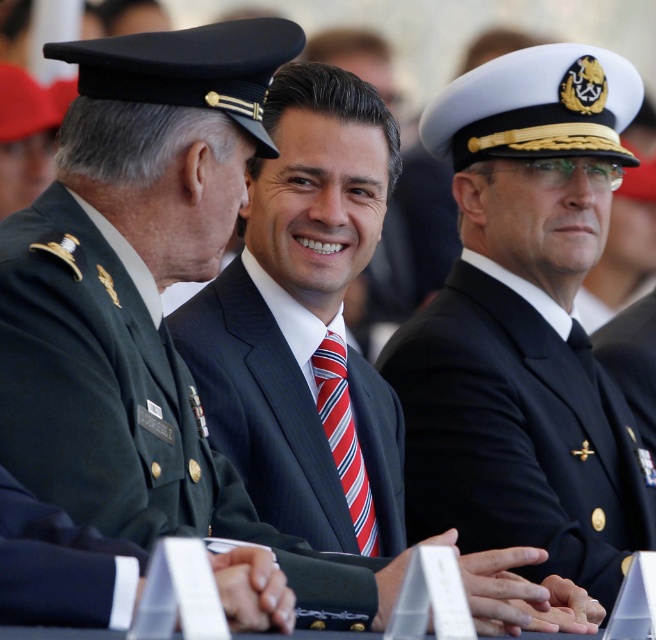
The height and width of the screenshot is (640, 656). Describe the element at coordinates (518, 429) in the screenshot. I see `navy blue fabric suit at center` at that location.

Identify the location of navy blue fabric suit at center. The width and height of the screenshot is (656, 640). tap(518, 429).